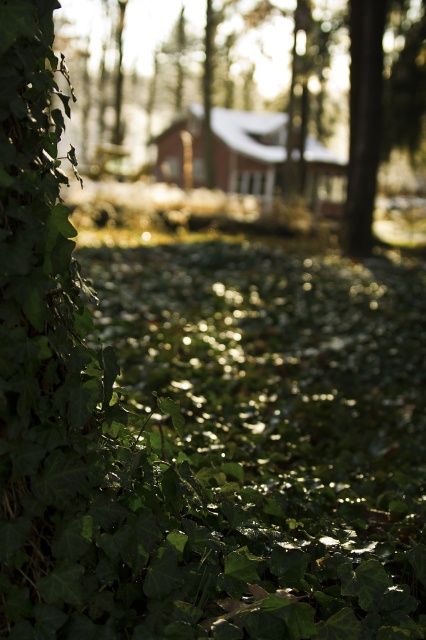
In the scene shown: Measure the distance between green leafy tree at left and camera.

green leafy tree at left is 41.33 feet from camera.

Who is more distant from viewer, (x=371, y=220) or (x=336, y=205)?

Positioned behind is point (x=336, y=205).

Describe the element at coordinates (356, 132) in the screenshot. The image size is (426, 640). I see `green leafy tree at left` at that location.

What are the coordinates of `green leafy tree at left` in the screenshot? It's located at (356, 132).